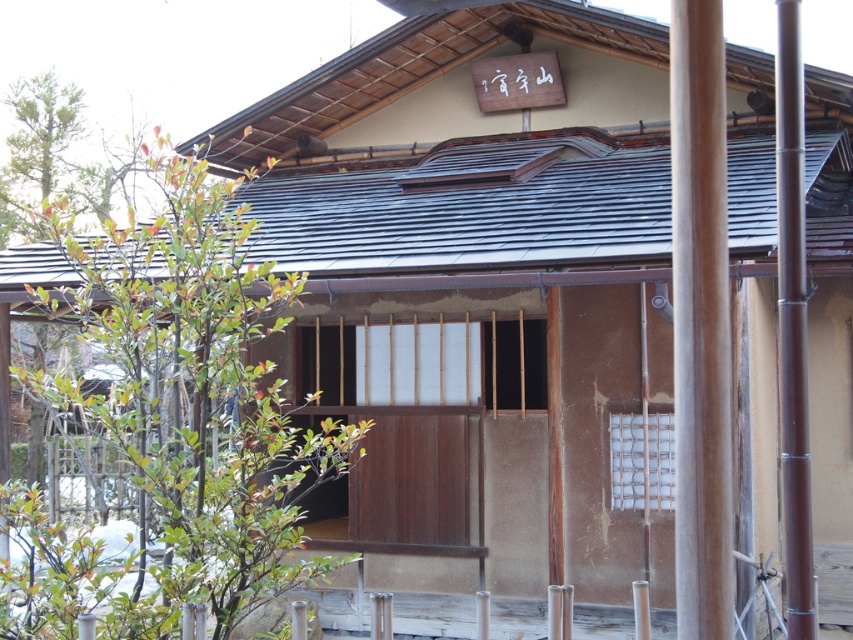
Can you confirm if brown wood pole at right is positioned to the right of brown bamboo pole at right?

Incorrect, brown wood pole at right is not on the right side of brown bamboo pole at right.

The width and height of the screenshot is (853, 640). What are the coordinates of `brown wood pole at right` in the screenshot? It's located at (700, 323).

Locate an element on the screen. The height and width of the screenshot is (640, 853). brown wood pole at right is located at coordinates (700, 323).